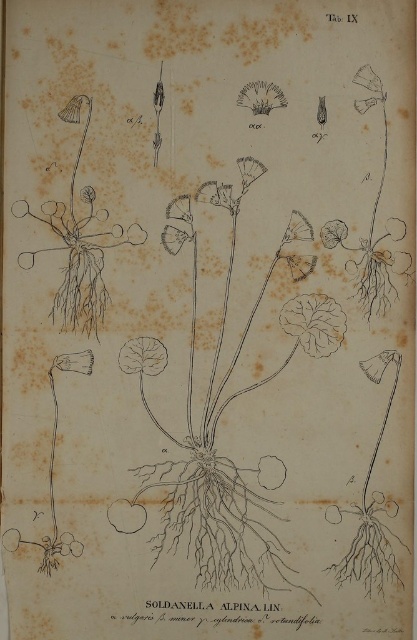
Is point (291, 304) less distant than point (279, 92)?

That is False.

Describe the element at coordinates (314, 323) in the screenshot. I see `green leafy plant at center` at that location.

This screenshot has height=640, width=417. Identify the location of green leafy plant at center. click(x=314, y=323).

Does green leafy at center have a smaller size compared to brown textured flower at upper center?

No.

In the scene shown: Is green leafy at center thinner than brown textured flower at upper center?

Yes.

Image resolution: width=417 pixels, height=640 pixels. Identify the location of green leafy at center. (143, 355).

The height and width of the screenshot is (640, 417). In order to click on green leafy at center in this screenshot , I will do `click(143, 355)`.

Is green leafy plant at center bigger than green leafy at center?

Indeed, green leafy plant at center has a larger size compared to green leafy at center.

Based on the photo, is green leafy plant at center below green leafy at center?

Actually, green leafy plant at center is above green leafy at center.

The image size is (417, 640). I want to click on green leafy plant at center, so click(x=314, y=323).